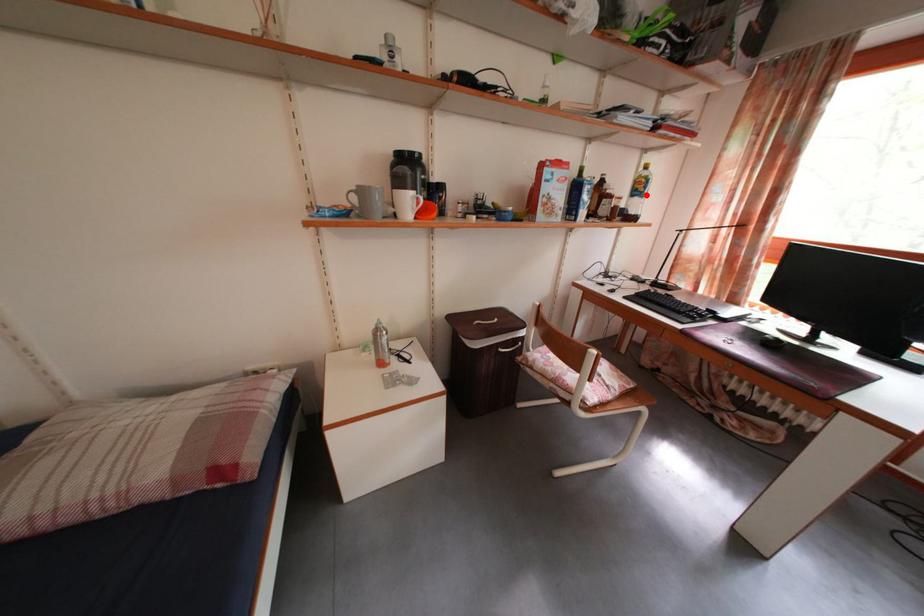
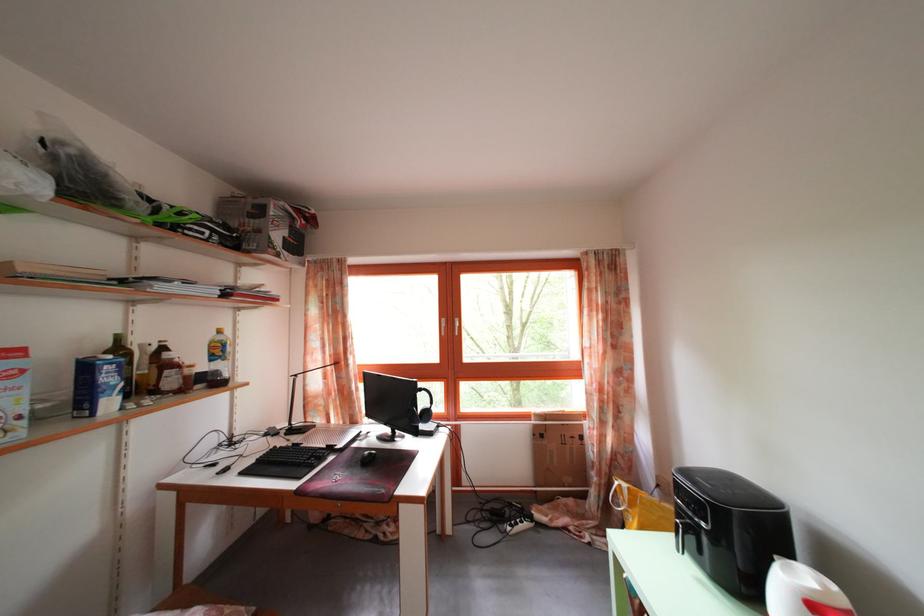
The point at the highlighted location is marked in the first image. Where is the corresponding point in the second image?

(225, 359)